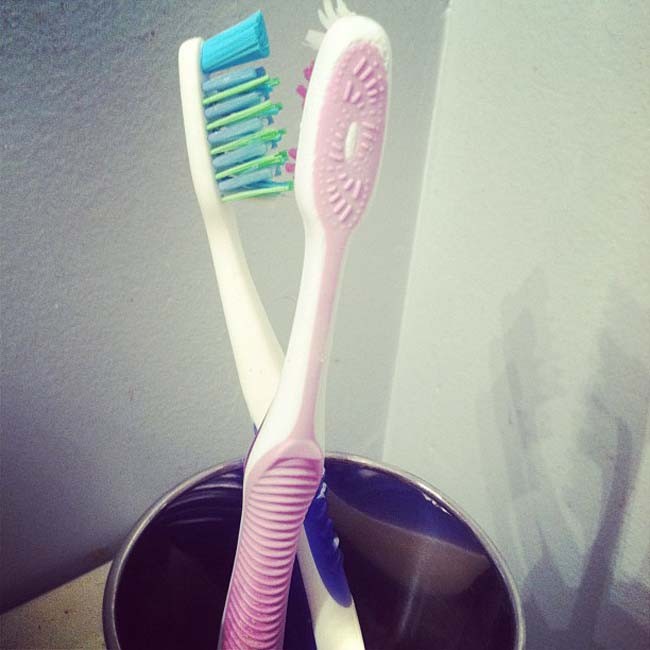
The image size is (650, 650). What are the coordinates of `white neck of toothbrush` in the screenshot? It's located at (239, 313), (296, 379).